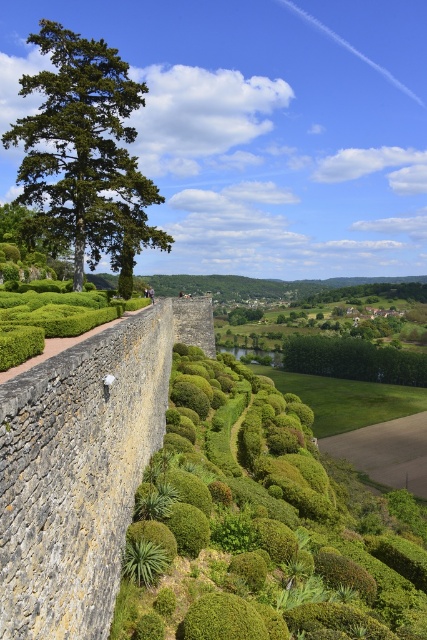
You are standing in the garden and want to place a small statue exactly halfway between point (178, 400) and point (73, 156). Will the statue be closer to the stone wall or the tall tree?

The statue placed halfway between point (178, 400) and point (73, 156) would be closer to the stone wall because point (178, 400) is further away from the viewer than point (73, 156), so the midpoint leans towards the wall side.

You are a gardener planning to install a birdhouse. The birdhouse requires a support structure that can be attached to either the green leafy hedge at center or the green leafy tree at upper left. Based on their heights, which object would be more suitable for mounting the birdhouse?

The green leafy tree at upper left is taller than the green leafy hedge at center, so it would be more suitable for mounting the birdhouse as it provides a higher support structure.

You are a landscape architect designing a walking path between the green leafy hedge at center and the green leafy tree at upper left. The path must be straight and 2 meters wide. Can you fit the path between them without overlapping either the hedge or the tree?

The green leafy hedge at center and green leafy tree at upper left are 24.05 meters apart. Since the path only needs to be 2 meters wide, the distance between them is sufficient to accommodate the path without overlapping either the hedge or the tree.